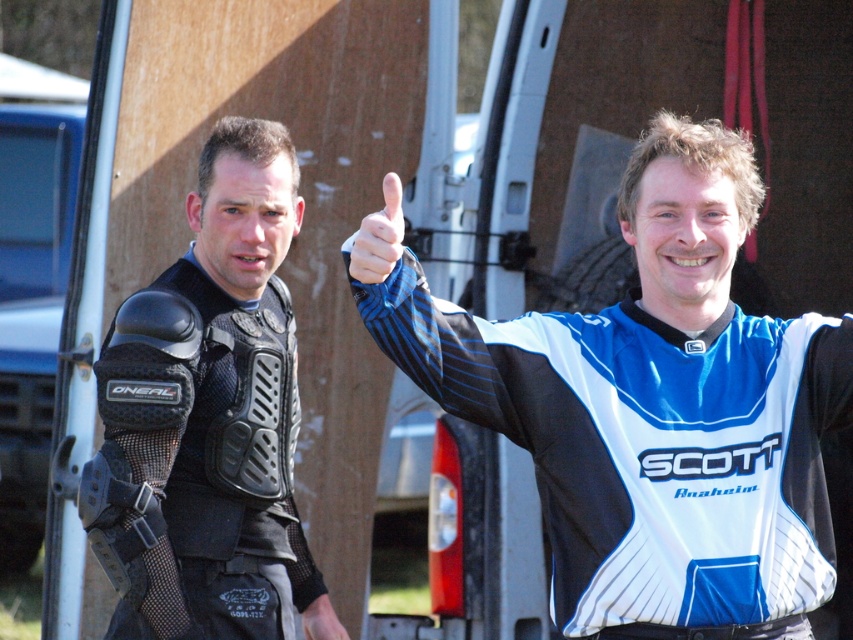
Does white/blue/black jersey at right have a larger size compared to matte black thumb at upper center?

Indeed, white/blue/black jersey at right has a larger size compared to matte black thumb at upper center.

Is point (647, 170) more distant than point (370, 252)?

Yes, it is.

Locate an element on the screen. white/blue/black jersey at right is located at coordinates (656, 410).

Between point (135, 385) and point (321, 618), which one is positioned in front?

Point (135, 385) is in front.

Does point (218, 276) lie in front of point (322, 634)?

Yes.

Is point (192, 595) closer to viewer compared to point (312, 637)?

Yes, it is.

Where is `black mesh vest at left`? black mesh vest at left is located at coordinates (207, 416).

Between white/blue/black jersey at right and black mesh vest at left, which one has less height?

With less height is white/blue/black jersey at right.

Identify the location of white/blue/black jersey at right. Image resolution: width=853 pixels, height=640 pixels. (656, 410).

Between point (706, 406) and point (271, 392), which one is positioned in front?

Positioned in front is point (706, 406).

This screenshot has width=853, height=640. In order to click on white/blue/black jersey at right in this screenshot , I will do `click(656, 410)`.